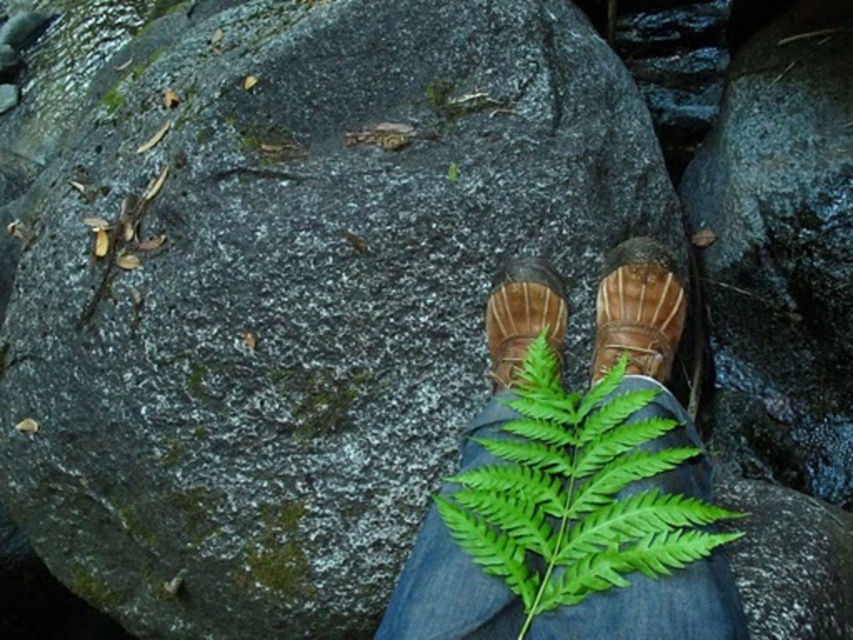
You are a photographer aiming to capture a detailed closeup of the green leafy plant at center. Your camera has a minimum focusing distance of 30 inches. Can you take the photo without moving closer?

The green leafy plant at center is 30.14 inches away from the viewer, which is slightly beyond the camera minimum focusing distance of 30 inches. Therefore, you cannot take the photo without moving closer.

You are a hiker who wants to ensure your footwear is properly positioned on the rock. Based on the image, which footwear item is higher up on the rock between the brown leather boot at center and the brown suede shoe at center?

The brown leather boot at center is higher up on the rock compared to the brown suede shoe at center, as it is positioned above it.

You are a hiker trying to avoid stepping on the green leafy plant at center. Since you are facing the brown suede shoe at center, which direction should you move to step around it?

The green leafy plant at center is to the right of the brown suede shoe at center, so you should move to the left to step around it.